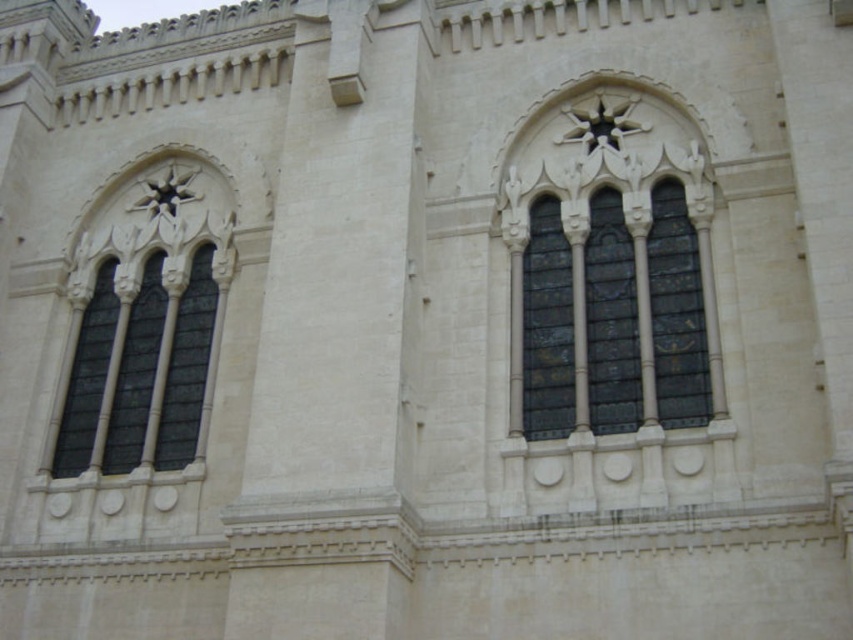
Question: Can you confirm if stained glass window at center is positioned below dark glass windows at left?

Choices:
 (A) yes
 (B) no

Answer: (B)

Question: Which point is closer to the camera?

Choices:
 (A) stained glass window at center
 (B) dark glass windows at left

Answer: (A)

Question: Which of the following is the closest to the observer?

Choices:
 (A) (194, 413)
 (B) (664, 371)

Answer: (B)

Question: Does stained glass window at center have a lesser width compared to dark glass windows at left?

Choices:
 (A) no
 (B) yes

Answer: (B)

Question: Is stained glass window at center positioned in front of dark glass windows at left?

Choices:
 (A) yes
 (B) no

Answer: (A)